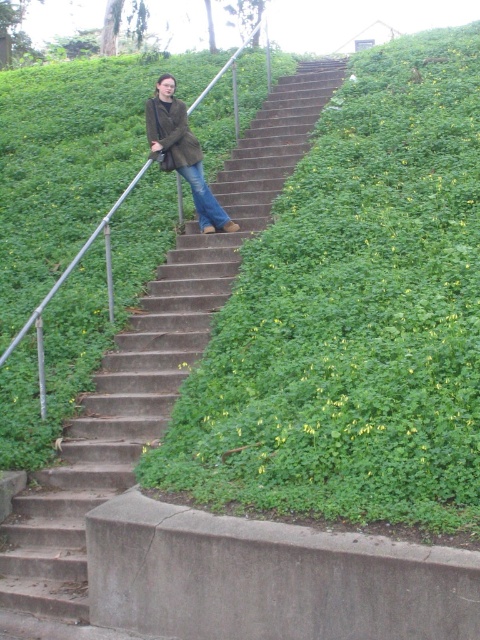
Which is behind, point (2, 538) or point (182, 113)?

Point (182, 113)

In the scene shown: Is the position of concrete stairs at center less distant than that of matte brown jacket at upper center?

Yes, concrete stairs at center is in front of matte brown jacket at upper center.

The image size is (480, 640). I want to click on concrete stairs at center, so click(x=152, y=360).

Who is more distant from viewer, (81, 417) or (145, 108)?

The point (145, 108) is more distant.

Where is `concrete stairs at center`? concrete stairs at center is located at coordinates (152, 360).

Is point (159, 100) farther from viewer compared to point (191, 157)?

That is False.

What do you see at coordinates (182, 152) in the screenshot? The width and height of the screenshot is (480, 640). I see `matte brown coat at center` at bounding box center [182, 152].

Does point (228, 228) lie behind point (180, 129)?

Yes, point (228, 228) is farther from viewer.

Find the location of a particular element. The width and height of the screenshot is (480, 640). matte brown coat at center is located at coordinates (182, 152).